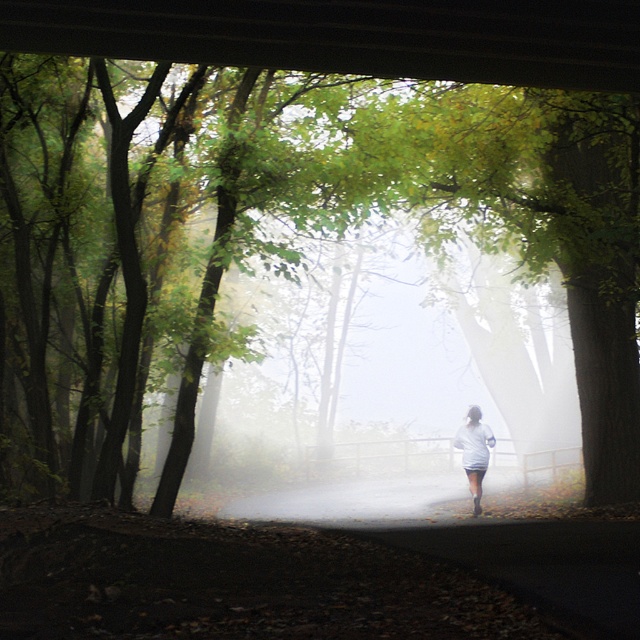
You are standing in the misty forest and want to reach the two points marked in the image. Which point, point (152, 508) or point (472, 454), is closer to you?

Point (152, 508) is closer to the viewer than point (472, 454).

You are a hiker who wants to take a photo of the green leafy tree at center and the white matte shirt at center. Which object should you zoom in on to capture both in the frame without moving the camera?

The green leafy tree at center is bigger than the white matte shirt at center, so you should zoom in on the white matte shirt at center to ensure both fit in the frame.